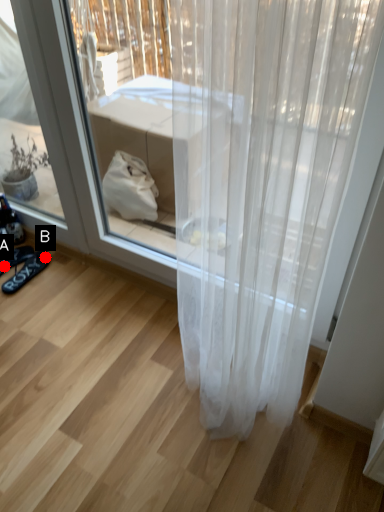
Question: Two points are circled on the image, labeled by A and B beside each circle. Which point is closer to the camera?

Choices:
 (A) A is closer
 (B) B is closer

Answer: (A)